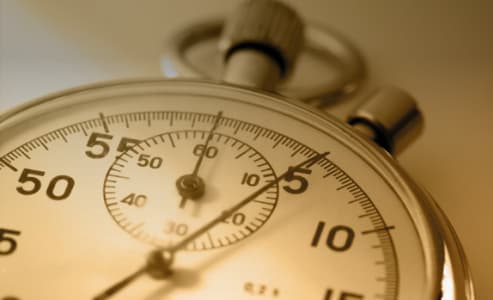
At what (x,y) coordinates should I click in order to perform the action: click on alarm. Please return your answer as a coordinate pair (x, y). Looking at the image, I should click on (151, 267).